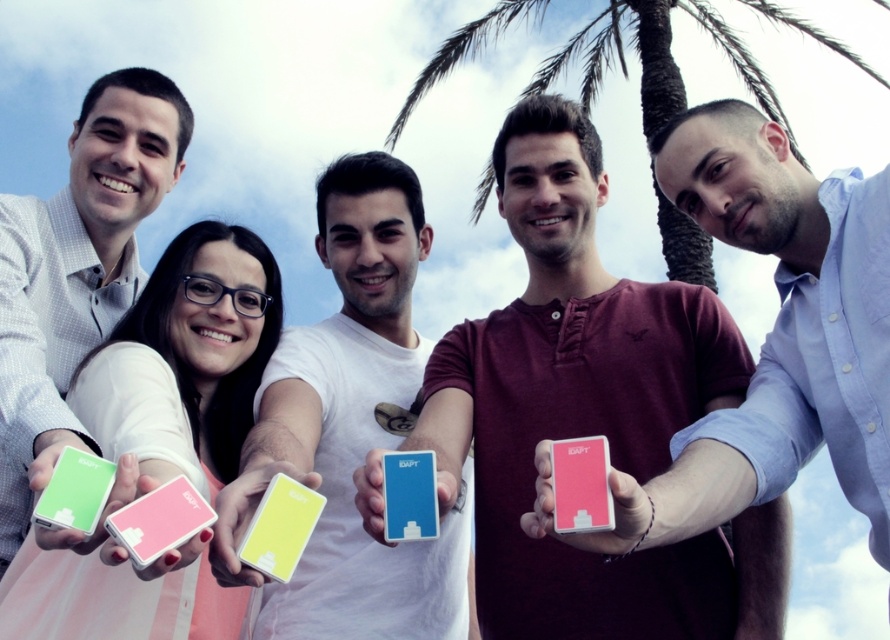
Is point (272, 445) farther from viewer compared to point (395, 476)?

Yes, point (272, 445) is farther from viewer.

Between white matte phone at center and blue matte card at center, which one is positioned higher?

blue matte card at center

Describe the element at coordinates (352, 429) in the screenshot. The image size is (890, 640). I see `white matte phone at center` at that location.

The width and height of the screenshot is (890, 640). I want to click on white matte phone at center, so 352,429.

Is yellow matte card game at center wider than pink matte card at lower left?

No, yellow matte card game at center is not wider than pink matte card at lower left.

Can you confirm if yellow matte card game at center is positioned above pink matte card at lower left?

Actually, yellow matte card game at center is below pink matte card at lower left.

Between point (282, 545) and point (120, 522), which one is positioned behind?

The point (282, 545) is behind.

What are the coordinates of `yellow matte card game at center` in the screenshot? It's located at (280, 528).

Is point (620, 397) less distant than point (86, 454)?

No, it is behind (86, 454).

Does matte plastic phone at center appear over green matte card at left?

Yes, matte plastic phone at center is above green matte card at left.

What do you see at coordinates (589, 413) in the screenshot? The height and width of the screenshot is (640, 890). I see `matte plastic phone at center` at bounding box center [589, 413].

This screenshot has height=640, width=890. What are the coordinates of `matte plastic phone at center` in the screenshot? It's located at (589, 413).